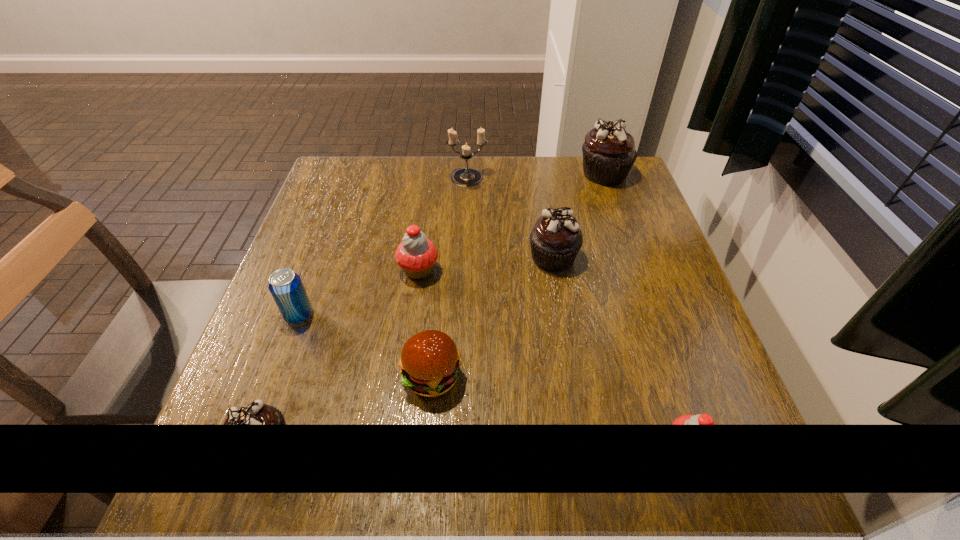
The height and width of the screenshot is (540, 960). In order to click on the farthest cupcake in this screenshot , I will do `click(609, 153)`.

At what (x,y) coordinates should I click in order to perform the action: click on the tallest cupcake. Please return your answer as a coordinate pair (x, y). The width and height of the screenshot is (960, 540). Looking at the image, I should click on (609, 153).

Find the location of a particular element. candle holder is located at coordinates (465, 177).

Where is `the left red cupcake`? The width and height of the screenshot is (960, 540). the left red cupcake is located at coordinates (416, 255).

Locate an element on the screen. This screenshot has width=960, height=540. the farther red cupcake is located at coordinates (416, 255).

In order to click on the third cupcake from right to left in this screenshot , I will do `click(556, 238)`.

Identify the location of the second brown cupcake from left to right. Image resolution: width=960 pixels, height=540 pixels. (556, 238).

Where is `blue beer can`? The image size is (960, 540). blue beer can is located at coordinates (285, 286).

This screenshot has height=540, width=960. What are the coordinates of `beer can` in the screenshot? It's located at (285, 286).

Where is `the sixth farthest object`? The image size is (960, 540). the sixth farthest object is located at coordinates (430, 364).